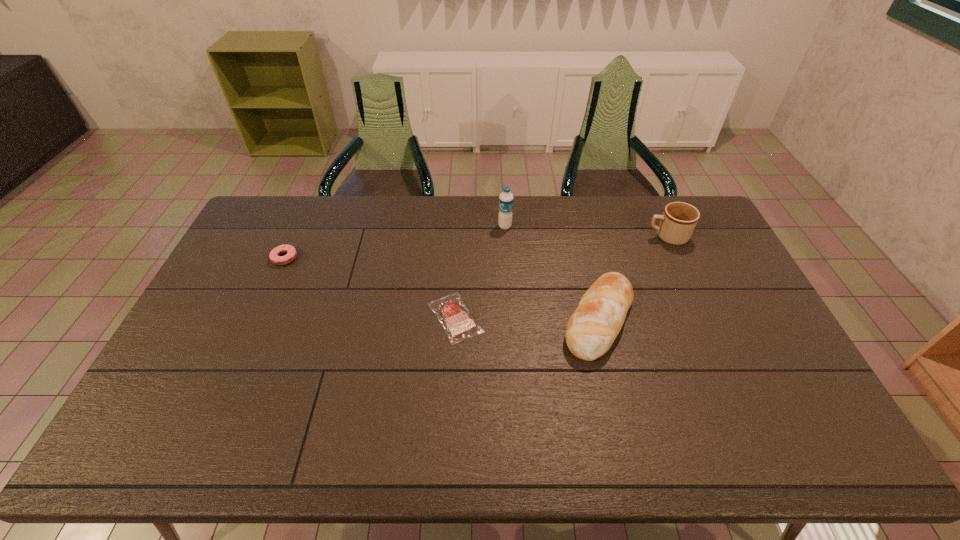
Image resolution: width=960 pixels, height=540 pixels. What are the coordinates of `free region located 0.350m on the label of the third object from right to left` in the screenshot? It's located at (403, 226).

Where is `vacant space located 0.170m on the side of the mug with the handle`? The width and height of the screenshot is (960, 540). vacant space located 0.170m on the side of the mug with the handle is located at coordinates (x=599, y=237).

The image size is (960, 540). In order to click on free space located 0.150m on the side of the mug with the handle in this screenshot , I will do `click(605, 237)`.

This screenshot has height=540, width=960. Find the location of `free space located 0.240m on the side of the mug with the handle`. free space located 0.240m on the side of the mug with the handle is located at coordinates pos(580,237).

Identify the location of free space located 0.270m on the back of the bread. The image size is (960, 540). (578, 228).

Find the location of a particular element. free space located 0.090m on the right of the fourth tallest object is located at coordinates (324, 258).

Where is `free location located 0.170m on the right of the fourth object from right to left`? free location located 0.170m on the right of the fourth object from right to left is located at coordinates (540, 318).

The height and width of the screenshot is (540, 960). I want to click on water bottle present at the far edge, so click(x=506, y=198).

The height and width of the screenshot is (540, 960). In order to click on mug at the far edge in this screenshot , I will do [x=679, y=219].

Locate an element on the screen. The height and width of the screenshot is (540, 960). object that is at the left edge is located at coordinates (274, 256).